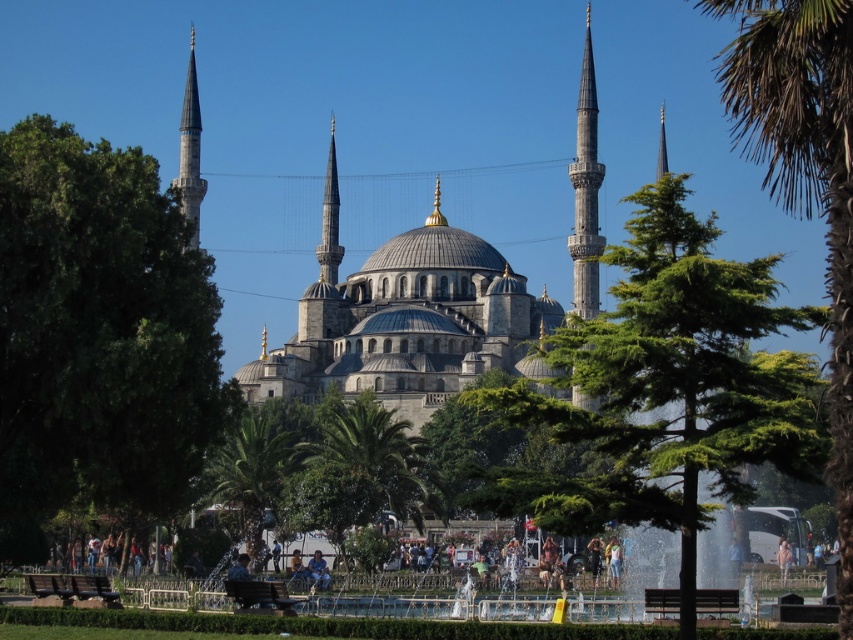
You are a tourist visiting the Blue Mosque and want to take a photo of both the green leafy tree at left and the dark brown wooden bench at lower center in the same frame. Given their sizes, which object should you position closer to the camera to ensure both fit well in the photo?

Since the green leafy tree at left is larger than the dark brown wooden bench at lower center, you should position the bench closer to the camera so that both objects appear balanced in size within the photo.

You are visiting the Blue Mosque in Istanbul and want to take a photo of the mosque with both the green leafy tree at left and the wooden park bench at lower center in the frame. Based on their distance, is it possible to capture both in a single photo without moving your position?

The green leafy tree at left is 17.04 meters away from the wooden park bench at lower center. Since they are relatively close to each other, it should be possible to capture both in a single photo without moving your position.

You are planning to take a photo of the Blue Mosque with both the green textured tree at center and the dark brown wooden bench at lower center in the frame. Which object will appear wider in the photo?

The green textured tree at center will appear wider in the photo since its width surpasses that of the dark brown wooden bench at lower center according to the description.